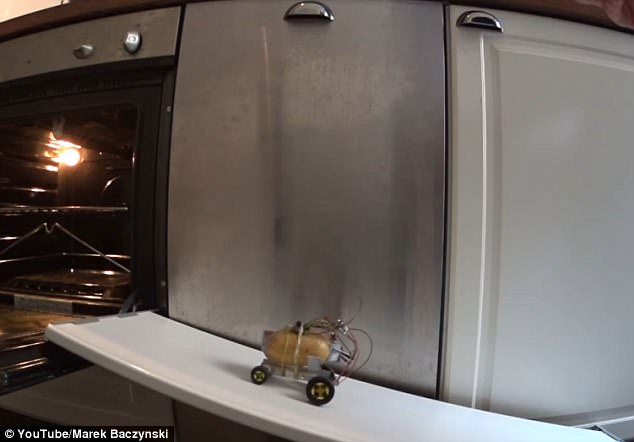
Find the location of a particular element. wall is located at coordinates (141, 18), (11, 7).